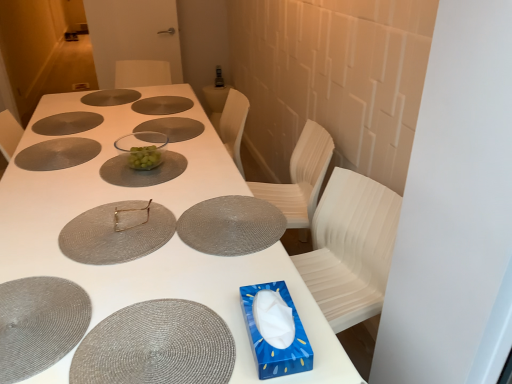
Image resolution: width=512 pixels, height=384 pixels. I want to click on free space to the left of matte gray placemat at center, arranged as the second glass plate when viewed from the front, so click(36, 218).